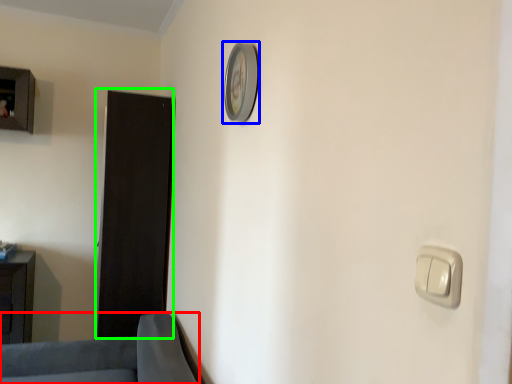
Question: Considering the real-world distances, which object is farthest from furniture (highlighted by a red box)? clock (highlighted by a blue box) or door (highlighted by a green box)?

Choices:
 (A) clock
 (B) door

Answer: (A)